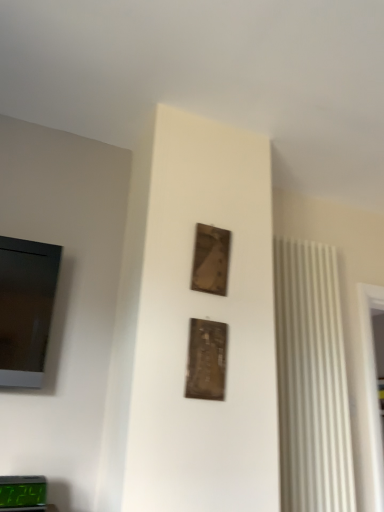
Question: Which direction should I rotate to face wooden frame at upper center, the second picture frame in the bottom-to-top sequence, — up or down?

Choices:
 (A) down
 (B) up

Answer: (A)

Question: Is wooden frame at upper center, the second picture frame in the bottom-to-top sequence, bigger than green digital display at lower left?

Choices:
 (A) yes
 (B) no

Answer: (B)

Question: Considering the relative sizes of wooden frame at upper center, the 2th picture frame positioned from the front, and green digital display at lower left in the image provided, is wooden frame at upper center, the 2th picture frame positioned from the front, wider than green digital display at lower left?

Choices:
 (A) no
 (B) yes

Answer: (A)

Question: Can you confirm if wooden frame at upper center, which is the 1th picture frame in top-to-bottom order, is shorter than green digital display at lower left?

Choices:
 (A) yes
 (B) no

Answer: (B)

Question: From a real-world perspective, is wooden frame at upper center, which is the 1th picture frame in top-to-bottom order, positioned over green digital display at lower left based on gravity?

Choices:
 (A) yes
 (B) no

Answer: (A)

Question: From the image's perspective, is wooden frame at upper center, the 2th picture frame positioned from the front, located beneath green digital display at lower left?

Choices:
 (A) yes
 (B) no

Answer: (B)

Question: Considering the relative sizes of wooden frame at upper center, the 1th picture frame positioned from the back, and green digital display at lower left in the image provided, is wooden frame at upper center, the 1th picture frame positioned from the back, taller than green digital display at lower left?

Choices:
 (A) no
 (B) yes

Answer: (B)

Question: Does metallic gold picture frame at center, arranged as the second picture frame when viewed from the back, contain green digital display at lower left?

Choices:
 (A) yes
 (B) no

Answer: (B)

Question: Is metallic gold picture frame at center, the 1th picture frame positioned from the front, further to the viewer compared to green digital display at lower left?

Choices:
 (A) no
 (B) yes

Answer: (B)

Question: Does metallic gold picture frame at center, arranged as the second picture frame when viewed from the back, have a smaller size compared to green digital display at lower left?

Choices:
 (A) yes
 (B) no

Answer: (A)

Question: Is metallic gold picture frame at center, acting as the first picture frame starting from the bottom, shorter than green digital display at lower left?

Choices:
 (A) no
 (B) yes

Answer: (A)

Question: Is metallic gold picture frame at center, placed as the second picture frame when sorted from top to bottom, oriented away from green digital display at lower left?

Choices:
 (A) no
 (B) yes

Answer: (A)

Question: From the image's perspective, does metallic gold picture frame at center, arranged as the second picture frame when viewed from the back, appear lower than green digital display at lower left?

Choices:
 (A) yes
 (B) no

Answer: (B)

Question: Does green digital display at lower left touch metallic gold picture frame at center, arranged as the second picture frame when viewed from the back?

Choices:
 (A) no
 (B) yes

Answer: (A)